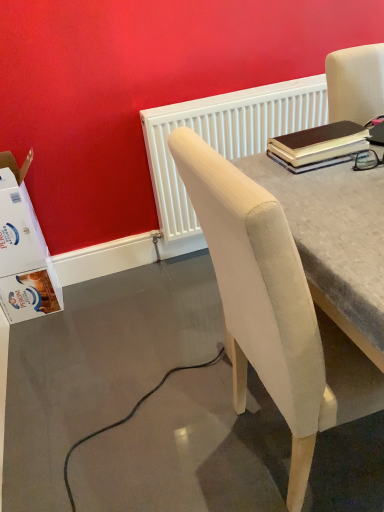
What do you see at coordinates (261, 297) in the screenshot? I see `beige fabric chair at upper right` at bounding box center [261, 297].

This screenshot has width=384, height=512. Find the location of `white cardboard box at lower left`. white cardboard box at lower left is located at coordinates (23, 251).

Locate an element on the screen. white textured radiator at upper center is located at coordinates (225, 136).

From their relative heights in the image, would you say white cardboard box at lower left is taller or shorter than brown leather notebook at upper right?

Considering their sizes, white cardboard box at lower left has more height than brown leather notebook at upper right.

Considering the points (4, 231) and (305, 153), which point is behind, point (4, 231) or point (305, 153)?

Positioned behind is point (4, 231).

Is brown leather notebook at upper right completely or partially inside white cardboard box at lower left?

No, brown leather notebook at upper right is not inside white cardboard box at lower left.

Find the location of a particular element. notebook in front of the white cardboard box at lower left is located at coordinates (320, 143).

Between brown leather notebook at upper right and white textured radiator at upper center, which one has more height?

white textured radiator at upper center.

Is brown leather notebook at upper right directly adjacent to white textured radiator at upper center?

brown leather notebook at upper right and white textured radiator at upper center are not in contact.

Is brown leather notebook at upper right thinner than white textured radiator at upper center?

Incorrect, the width of brown leather notebook at upper right is not less than that of white textured radiator at upper center.

Is brown leather notebook at upper right facing towards white textured radiator at upper center?

No, brown leather notebook at upper right is not facing towards white textured radiator at upper center.

Does white cardboard box at lower left have a greater width compared to beige fabric chair at upper right?

In fact, white cardboard box at lower left might be narrower than beige fabric chair at upper right.

From a real-world perspective, is white cardboard box at lower left physically below beige fabric chair at upper right?

Yes.

Is beige fabric chair at upper right a part of white cardboard box at lower left?

No, beige fabric chair at upper right is not a part of white cardboard box at lower left.

Which of these two, brown leather notebook at upper right or white cardboard box at lower left, is wider?

white cardboard box at lower left.

I want to click on notebook on the right side of white cardboard box at lower left, so click(x=320, y=143).

Between point (289, 136) and point (26, 201), which one is positioned in front?

Positioned in front is point (289, 136).

From a real-world perspective, relative to brown leather notebook at upper right, is beige fabric chair at upper right vertically above or below?

In terms of real-world spatial position, beige fabric chair at upper right is below brown leather notebook at upper right.

Between beige fabric chair at upper right and brown leather notebook at upper right, which one has larger width?

beige fabric chair at upper right.

Looking at this image, which is further, [312,391] or [293,148]?

Positioned behind is point [293,148].

Between beige fabric chair at upper right and brown leather notebook at upper right, which one has less height?

With less height is brown leather notebook at upper right.

Is brown leather notebook at upper right placed right next to beige fabric chair at upper right?

They are not placed beside each other.

From the image's perspective, would you say brown leather notebook at upper right is shown under beige fabric chair at upper right?

Incorrect, from the image's perspective, brown leather notebook at upper right is higher than beige fabric chair at upper right.

Considering the sizes of objects brown leather notebook at upper right and beige fabric chair at upper right in the image provided, who is bigger, brown leather notebook at upper right or beige fabric chair at upper right?

beige fabric chair at upper right is bigger.

In the image, is brown leather notebook at upper right on the left side or the right side of beige fabric chair at upper right?

From the image, it's evident that brown leather notebook at upper right is to the left of beige fabric chair at upper right.

Is beige fabric chair at upper right turned away from white cardboard box at lower left?

No, white cardboard box at lower left is not at the back of beige fabric chair at upper right.

From the image's perspective, is beige fabric chair at upper right over white cardboard box at lower left?

Actually, beige fabric chair at upper right appears below white cardboard box at lower left in the image.

Can you tell me how much beige fabric chair at upper right and white cardboard box at lower left differ in facing direction?

The angle between the facing direction of beige fabric chair at upper right and the facing direction of white cardboard box at lower left is 0.134 degrees.

Looking at this image, considering the relative sizes of beige fabric chair at upper right and white cardboard box at lower left in the image provided, is beige fabric chair at upper right smaller than white cardboard box at lower left?

No.

At what (x,y) coordinates should I click in order to perform the action: click on box below the brown leather notebook at upper right (from the image's perspective). Please return your answer as a coordinate pair (x, y). Looking at the image, I should click on (23, 251).

The image size is (384, 512). I want to click on notebook above the white textured radiator at upper center (from a real-world perspective), so click(320, 143).

Considering their positions, is brown leather notebook at upper right positioned closer to white cardboard box at lower left than white textured radiator at upper center?

white textured radiator at upper center is positioned closer to the anchor white cardboard box at lower left.

Looking at the image, which one is located closer to white cardboard box at lower left, white textured radiator at upper center or beige fabric chair at upper right?

Among the two, white textured radiator at upper center is located nearer to white cardboard box at lower left.

From the image, which object appears to be nearer to brown leather notebook at upper right, white cardboard box at lower left or white textured radiator at upper center?

white textured radiator at upper center lies closer to brown leather notebook at upper right than the other object.

Looking at the image, which one is located closer to brown leather notebook at upper right, beige fabric chair at upper right or white cardboard box at lower left?

Among the two, beige fabric chair at upper right is located nearer to brown leather notebook at upper right.

Estimate the real-world distances between objects in this image. Which object is closer to white textured radiator at upper center, beige fabric chair at upper right or brown leather notebook at upper right?

Based on the image, brown leather notebook at upper right appears to be nearer to white textured radiator at upper center.

From the image, which object appears to be nearer to white cardboard box at lower left, white textured radiator at upper center or brown leather notebook at upper right?

white textured radiator at upper center lies closer to white cardboard box at lower left than the other object.

Estimate the real-world distances between objects in this image. Which object is closer to brown leather notebook at upper right, beige fabric chair at upper right or white textured radiator at upper center?

beige fabric chair at upper right.

Based on their spatial positions, is beige fabric chair at upper right or white textured radiator at upper center further from white cardboard box at lower left?

Based on the image, beige fabric chair at upper right appears to be further to white cardboard box at lower left.

The height and width of the screenshot is (512, 384). Identify the location of notebook located between white cardboard box at lower left and beige fabric chair at upper right in the left-right direction. (320, 143).

Locate an element on the screen. notebook positioned between beige fabric chair at upper right and white textured radiator at upper center from near to far is located at coordinates (320, 143).

Image resolution: width=384 pixels, height=512 pixels. I want to click on radiator located between white cardboard box at lower left and brown leather notebook at upper right in the left-right direction, so click(225, 136).

Identify the location of box between beige fabric chair at upper right and white textured radiator at upper center along the z-axis. The width and height of the screenshot is (384, 512). (23, 251).